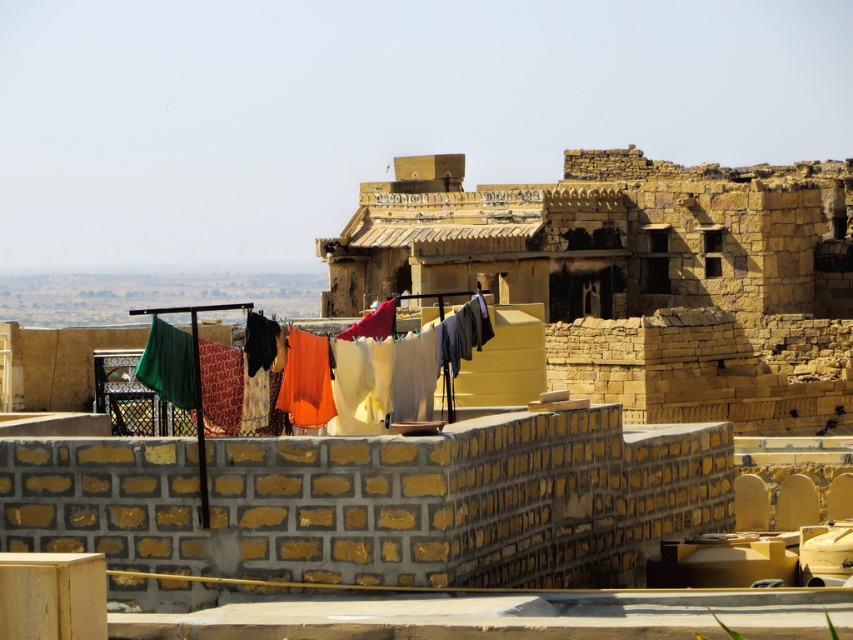
Question: Which object is farther from the camera taking this photo?

Choices:
 (A) rustic stone fort at center
 (B) textured fabric clothesline at center

Answer: (A)

Question: Among these objects, which one is nearest to the camera?

Choices:
 (A) textured fabric clothesline at center
 (B) rustic stone fort at center

Answer: (A)

Question: Can you confirm if rustic stone fort at center is bigger than textured fabric clothesline at center?

Choices:
 (A) yes
 (B) no

Answer: (B)

Question: Does rustic stone fort at center appear over textured fabric clothesline at center?

Choices:
 (A) yes
 (B) no

Answer: (A)

Question: Can you confirm if rustic stone fort at center is positioned above textured fabric clothesline at center?

Choices:
 (A) no
 (B) yes

Answer: (B)